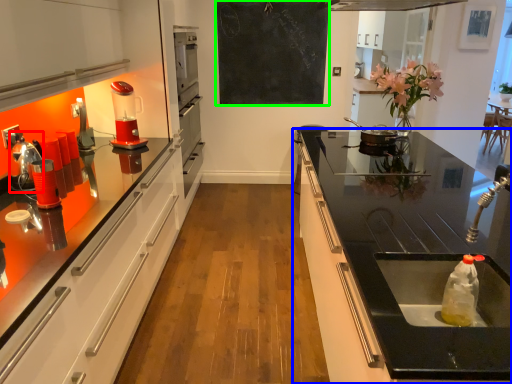
Question: Considering the real-world distances, which object is closest to appliance (highlighted by a red box)? countertop (highlighted by a blue box) or bulletin board (highlighted by a green box).

Choices:
 (A) countertop
 (B) bulletin board

Answer: (A)